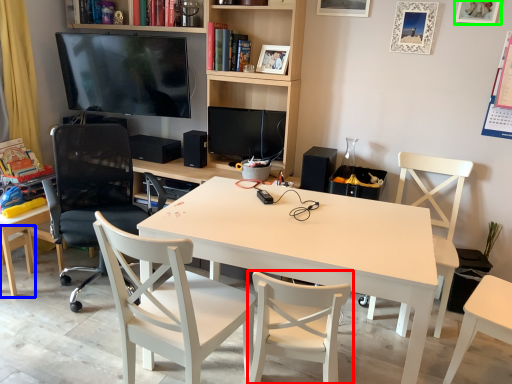
Question: Which object is the farthest from chair (highlighted by a red box)? Choose among these: chair (highlighted by a blue box) or picture frame (highlighted by a green box).

Choices:
 (A) chair
 (B) picture frame

Answer: (B)